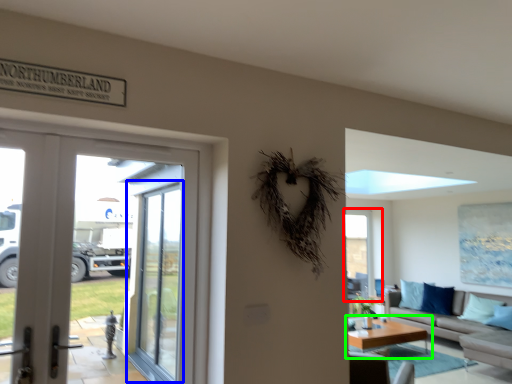
Question: Estimate the real-world distances between objects in this image. Which object is closer to window (highlighted by a red box), screen door (highlighted by a blue box) or coffee table (highlighted by a green box)?

Choices:
 (A) screen door
 (B) coffee table

Answer: (B)